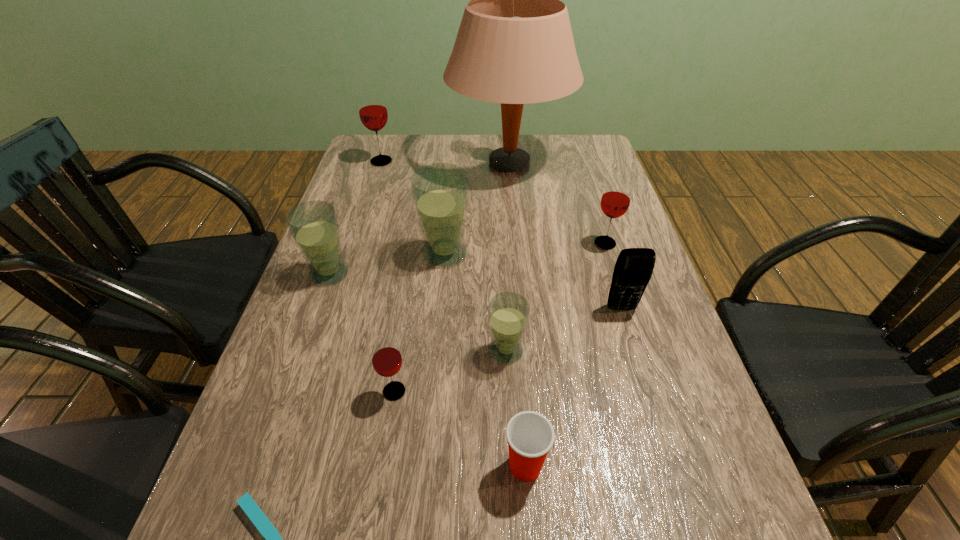
This screenshot has width=960, height=540. I want to click on the nearest glass, so click(386, 358).

Locate an element on the screen. Image resolution: width=960 pixels, height=540 pixels. the smallest blue glass is located at coordinates (508, 312).

The image size is (960, 540). Find the location of `the fourth nearest object`. the fourth nearest object is located at coordinates (508, 312).

Locate an element on the screen. the second nearest object is located at coordinates (530, 435).

You are a GUI agent. You are given a task and a screenshot of the screen. Output one action in this format:
    pyautogui.click(x=<x>, y=<y>)
    Task: Click on the Dixie cup
    
    Given the screenshot: What is the action you would take?
    pyautogui.click(x=530, y=435)

The height and width of the screenshot is (540, 960). I want to click on free space located 0.240m on the front-facing side of the lampshade, so click(375, 163).

Locate an element on the screen. vacant point located 0.070m on the front-facing side of the lampshade is located at coordinates (427, 163).

You are a GUI agent. You are given a task and a screenshot of the screen. Output one action in this format:
    pyautogui.click(x=<x>, y=<y>)
    Task: Click on the vacant area situated 0.060m on the front-facing side of the lampshade
    
    Given the screenshot: What is the action you would take?
    pyautogui.click(x=430, y=163)

At what (x,y) coordinates should I click in order to perform the action: click on free region located on the front of the farthest glass. Please return your answer as a coordinate pair (x, y). Image resolution: width=960 pixels, height=540 pixels. Looking at the image, I should click on (366, 210).

Locate an element on the screen. free space located 0.090m on the back of the second blue glass from right to left is located at coordinates (448, 217).